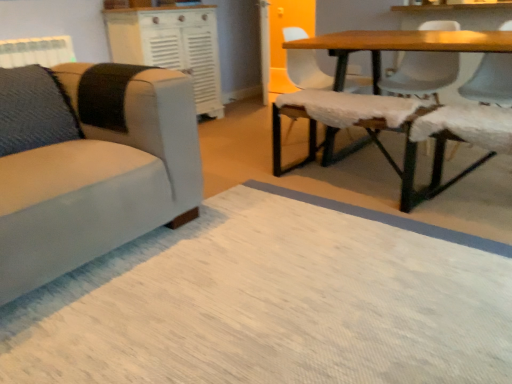
In order to click on unoccupied area in front of fuzzy fabric swivel chair at center in this screenshot , I will do `click(347, 226)`.